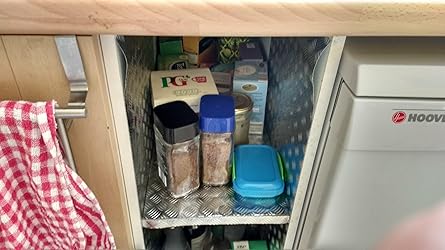
The width and height of the screenshot is (445, 250). In order to click on appliance in this screenshot , I will do `click(408, 138)`.